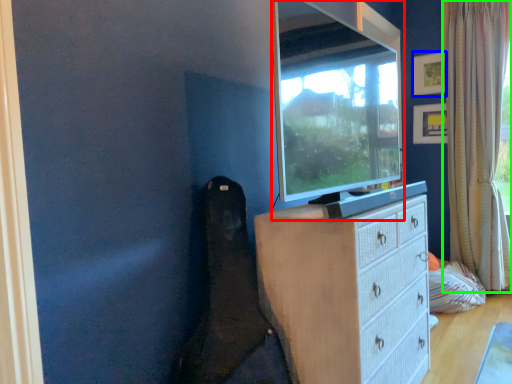
Question: Which object is positioned farthest from television (highlighted by a red box)? Select from picture frame (highlighted by a blue box) and curtain (highlighted by a green box).

Choices:
 (A) picture frame
 (B) curtain

Answer: (A)